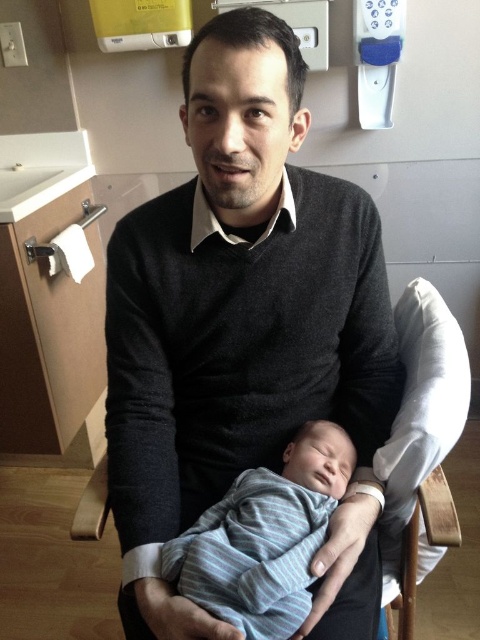
Question: Which object appears farthest from the camera in this image?

Choices:
 (A) wooden rocking chair at center
 (B) striped knit onesie at center

Answer: (A)

Question: Among these objects, which one is farthest from the camera?

Choices:
 (A) striped knit onesie at center
 (B) wooden rocking chair at center
 (C) dark gray sweater at center

Answer: (B)

Question: Can you confirm if dark gray sweater at center is positioned to the right of striped knit onesie at center?

Choices:
 (A) no
 (B) yes

Answer: (A)

Question: Is dark gray sweater at center bigger than wooden rocking chair at center?

Choices:
 (A) yes
 (B) no

Answer: (A)

Question: Does dark gray sweater at center appear over wooden rocking chair at center?

Choices:
 (A) yes
 (B) no

Answer: (A)

Question: Among these points, which one is farthest from the camera?

Choices:
 (A) (217, 628)
 (B) (388, 451)
 (C) (269, 612)

Answer: (B)